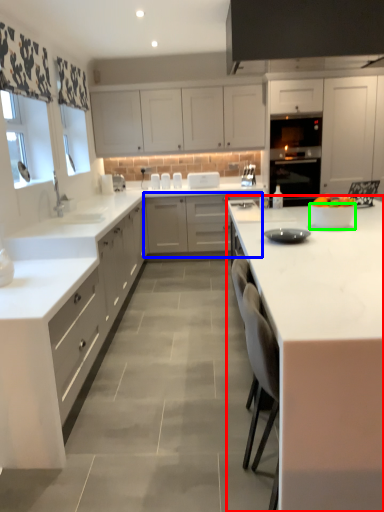
Question: Which is farther away from countertop (highlighted by a red box)? cabinetry (highlighted by a blue box) or bowl (highlighted by a green box)?

Choices:
 (A) cabinetry
 (B) bowl

Answer: (A)